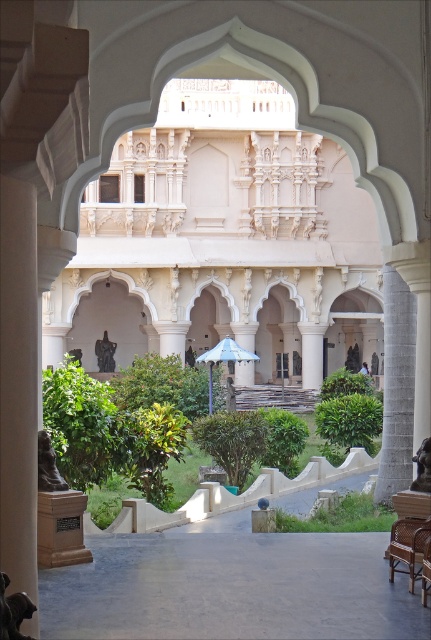
Which is more to the right, gray stone pillar at right or blue fabric umbrella at center?

gray stone pillar at right is more to the right.

Who is lower down, gray stone pillar at right or blue fabric umbrella at center?

Positioned lower is gray stone pillar at right.

The width and height of the screenshot is (431, 640). What do you see at coordinates (396, 387) in the screenshot?
I see `gray stone pillar at right` at bounding box center [396, 387].

You are a GUI agent. You are given a task and a screenshot of the screen. Output one action in this format:
    pyautogui.click(x=<x>, y=<y>)
    Task: Click on the gray stone pillar at right
    
    Given the screenshot: What is the action you would take?
    pyautogui.click(x=396, y=387)

Who is lower down, white marble pillar at left or brown woven chair at lower right?

brown woven chair at lower right is below.

Looking at this image, is white marble pillar at left taller than brown woven chair at lower right?

Indeed, white marble pillar at left has a greater height compared to brown woven chair at lower right.

Locate an element on the screen. The image size is (431, 640). white marble pillar at left is located at coordinates (18, 384).

Where is `white marble pillar at left`? white marble pillar at left is located at coordinates (18, 384).

Looking at this image, is white marble pillar at center bigger than blue fabric umbrella at center?

No, white marble pillar at center is not bigger than blue fabric umbrella at center.

Is point (243, 342) closer to camera compared to point (231, 356)?

No, it is behind (231, 356).

You are a GUI agent. You are given a task and a screenshot of the screen. Output one action in this format:
    pyautogui.click(x=<x>, y=<y>)
    Task: Click on the white marble pillar at center
    
    Given the screenshot: What is the action you would take?
    pyautogui.click(x=244, y=333)